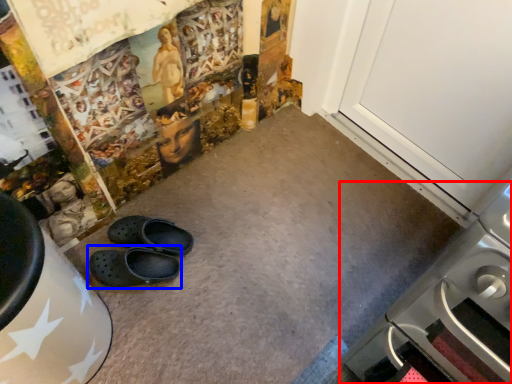
Question: Which of the following is the farthest to the observer, home appliance (highlighted by a red box) or footwear (highlighted by a blue box)?

Choices:
 (A) home appliance
 (B) footwear

Answer: (B)